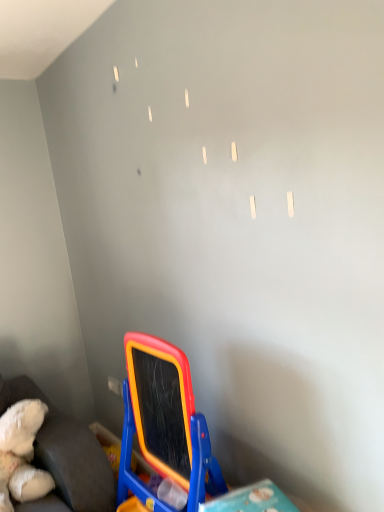
Measure the distance between point (92, 502) and camera.

The depth of point (92, 502) is 1.71 meters.

The image size is (384, 512). In order to click on white plush teddy bear at lower left in this screenshot , I will do `click(65, 455)`.

Describe the element at coordinates (65, 455) in the screenshot. I see `white plush teddy bear at lower left` at that location.

What do you see at coordinates (164, 424) in the screenshot?
I see `rubberized plastic easel at lower center` at bounding box center [164, 424].

The width and height of the screenshot is (384, 512). In order to click on rubberized plastic easel at lower center in this screenshot , I will do `click(164, 424)`.

This screenshot has height=512, width=384. Identify the location of white plush teddy bear at lower left. (65, 455).

Which is more to the right, white plush teddy bear at lower left or rubberized plastic easel at lower center?

From the viewer's perspective, rubberized plastic easel at lower center appears more on the right side.

Relative to rubberized plastic easel at lower center, is white plush teddy bear at lower left in front or behind?

In the image, white plush teddy bear at lower left appears behind rubberized plastic easel at lower center.

Does point (110, 504) appear closer or farther from the camera than point (189, 460)?

Point (110, 504) is farther from the camera than point (189, 460).

From the image's perspective, is white plush teddy bear at lower left positioned above or below rubberized plastic easel at lower center?

white plush teddy bear at lower left is situated lower than rubberized plastic easel at lower center in the image.

From a real-world perspective, between white plush teddy bear at lower left and rubberized plastic easel at lower center, who is vertically lower?

white plush teddy bear at lower left.

Does white plush teddy bear at lower left have a lesser width compared to rubberized plastic easel at lower center?

In fact, white plush teddy bear at lower left might be wider than rubberized plastic easel at lower center.

Does white plush teddy bear at lower left have a lesser height compared to rubberized plastic easel at lower center?

Correct, white plush teddy bear at lower left is not as tall as rubberized plastic easel at lower center.

Considering the relative sizes of white plush teddy bear at lower left and rubberized plastic easel at lower center in the image provided, is white plush teddy bear at lower left bigger than rubberized plastic easel at lower center?

No, white plush teddy bear at lower left is not bigger than rubberized plastic easel at lower center.

Is white plush teddy bear at lower left located outside rubberized plastic easel at lower center?

Yes, white plush teddy bear at lower left is outside of rubberized plastic easel at lower center.

Can you see white plush teddy bear at lower left touching rubberized plastic easel at lower center?

There is a gap between white plush teddy bear at lower left and rubberized plastic easel at lower center.

Is white plush teddy bear at lower left positioned with its back to rubberized plastic easel at lower center?

No, white plush teddy bear at lower left's orientation is not away from rubberized plastic easel at lower center.

How different are the orientations of white plush teddy bear at lower left and rubberized plastic easel at lower center in degrees?

The facing directions of white plush teddy bear at lower left and rubberized plastic easel at lower center are 88.2 degrees apart.

Identify the location of furniture behind the rubberized plastic easel at lower center. Image resolution: width=384 pixels, height=512 pixels. (65, 455).

Is rubberized plastic easel at lower center to the right of white plush teddy bear at lower left from the viewer's perspective?

Yes.

In the image, is rubberized plastic easel at lower center positioned in front of or behind white plush teddy bear at lower left?

rubberized plastic easel at lower center is in front of white plush teddy bear at lower left.

Does point (197, 447) come farther from viewer compared to point (90, 484)?

No, (197, 447) is closer to viewer.

From the image's perspective, who appears lower, rubberized plastic easel at lower center or white plush teddy bear at lower left?

white plush teddy bear at lower left, from the image's perspective.

From a real-world perspective, is rubberized plastic easel at lower center located higher than white plush teddy bear at lower left?

Yes, from a real-world perspective, rubberized plastic easel at lower center is over white plush teddy bear at lower left

Can you confirm if rubberized plastic easel at lower center is thinner than white plush teddy bear at lower left?

Correct, the width of rubberized plastic easel at lower center is less than that of white plush teddy bear at lower left.

Does rubberized plastic easel at lower center have a lesser height compared to white plush teddy bear at lower left?

In fact, rubberized plastic easel at lower center may be taller than white plush teddy bear at lower left.

Who is smaller, rubberized plastic easel at lower center or white plush teddy bear at lower left?

white plush teddy bear at lower left is smaller.

Can we say rubberized plastic easel at lower center lies outside white plush teddy bear at lower left?

Yes.

Would you consider rubberized plastic easel at lower center to be distant from white plush teddy bear at lower left?

Actually, rubberized plastic easel at lower center and white plush teddy bear at lower left are a little close together.

Is rubberized plastic easel at lower center turned away from white plush teddy bear at lower left?

No, rubberized plastic easel at lower center's orientation is not away from white plush teddy bear at lower left.

What's the angular difference between rubberized plastic easel at lower center and white plush teddy bear at lower left's facing directions?

There is a 88.2-degree angle between the facing directions of rubberized plastic easel at lower center and white plush teddy bear at lower left.

How much distance is there between rubberized plastic easel at lower center and white plush teddy bear at lower left?

The distance of rubberized plastic easel at lower center from white plush teddy bear at lower left is 16.54 inches.

In the image, there is a rubberized plastic easel at lower center. Where is `furniture below it (from a real-world perspective)`? furniture below it (from a real-world perspective) is located at coordinates (65, 455).

Locate an element on the screen. The image size is (384, 512). furniture lying below the rubberized plastic easel at lower center (from the image's perspective) is located at coordinates coord(65,455).

Image resolution: width=384 pixels, height=512 pixels. I want to click on furniture that appears behind the rubberized plastic easel at lower center, so click(x=65, y=455).